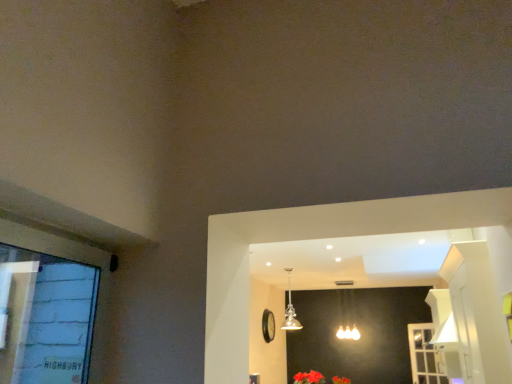
The image size is (512, 384). Describe the element at coordinates (424, 355) in the screenshot. I see `white plastic screen door at lower right` at that location.

Where is `matte silver lamp at center, the first lamp when ordered from right to left`? matte silver lamp at center, the first lamp when ordered from right to left is located at coordinates (346, 323).

What is the approximate width of fluffy fabric flower at lower center, which appears as the first flower when ordered from the bottom?

It is 16.92 inches.

Locate an element on the screen. The image size is (512, 384). gold glass pendant light at center, which is the second lamp from back to front is located at coordinates (290, 309).

Is gold glass pendant light at center, the first lamp positioned from the left, located within fluffy fabric flower at lower center, the 2th flower positioned from the front?

Definitely not — gold glass pendant light at center, the first lamp positioned from the left, is not inside fluffy fabric flower at lower center, the 2th flower positioned from the front.

From the image's perspective, is fluffy fabric flower at lower center, the 2th flower positioned from the front, on top of gold glass pendant light at center, which is the second lamp from back to front?

No, from the image's perspective, fluffy fabric flower at lower center, the 2th flower positioned from the front, is not above gold glass pendant light at center, which is the second lamp from back to front.

Is fluffy fabric flower at lower center, the 2th flower viewed from the top, taller than gold glass pendant light at center, the first lamp positioned from the left?

No.

Is vivid red petals at lower center, the 2th flower from the back, surrounded by fluffy fabric flower at lower center, the 2th flower viewed from the top?

No, vivid red petals at lower center, the 2th flower from the back, is not a part of fluffy fabric flower at lower center, the 2th flower viewed from the top.

Considering the sizes of objects fluffy fabric flower at lower center, the 2th flower positioned from the front, and vivid red petals at lower center, which is the second flower from right to left, in the image provided, who is taller, fluffy fabric flower at lower center, the 2th flower positioned from the front, or vivid red petals at lower center, which is the second flower from right to left,?

With more height is fluffy fabric flower at lower center, the 2th flower positioned from the front.

Could you measure the distance between fluffy fabric flower at lower center, the 2th flower viewed from the top, and vivid red petals at lower center, which appears as the 2th flower when ordered from the bottom?

fluffy fabric flower at lower center, the 2th flower viewed from the top, is 13.78 inches away from vivid red petals at lower center, which appears as the 2th flower when ordered from the bottom.

Which object is positioned more to the left, fluffy fabric flower at lower center, which appears as the first flower when ordered from the bottom, or vivid red petals at lower center, marked as the first flower in a top-to-bottom arrangement?

vivid red petals at lower center, marked as the first flower in a top-to-bottom arrangement, is more to the left.

Looking at this image, considering the sizes of objects matte silver lamp at center, arranged as the 2th lamp when viewed from the front, and vivid red petals at lower center, marked as the first flower in a top-to-bottom arrangement, in the image provided, who is wider, matte silver lamp at center, arranged as the 2th lamp when viewed from the front, or vivid red petals at lower center, marked as the first flower in a top-to-bottom arrangement,?

Wider between the two is vivid red petals at lower center, marked as the first flower in a top-to-bottom arrangement.

Considering the relative sizes of matte silver lamp at center, which is the 1th lamp from back to front, and vivid red petals at lower center, which is the second flower from right to left, in the image provided, is matte silver lamp at center, which is the 1th lamp from back to front, bigger than vivid red petals at lower center, which is the second flower from right to left,?

Correct, matte silver lamp at center, which is the 1th lamp from back to front, is larger in size than vivid red petals at lower center, which is the second flower from right to left.

Is there a large distance between matte silver lamp at center, arranged as the 2th lamp when viewed from the front, and vivid red petals at lower center, the 2th flower from the back?

matte silver lamp at center, arranged as the 2th lamp when viewed from the front, is actually quite close to vivid red petals at lower center, the 2th flower from the back.

Considering the positions of point (339, 326) and point (321, 381), is point (339, 326) closer or farther from the camera than point (321, 381)?

Clearly, point (339, 326) is more distant from the camera than point (321, 381).

Can you confirm if white plastic screen door at lower right is smaller than matte silver lamp at center, which is the 1th lamp from back to front?

Indeed, white plastic screen door at lower right has a smaller size compared to matte silver lamp at center, which is the 1th lamp from back to front.

Which is more to the left, white plastic screen door at lower right or matte silver lamp at center, which is the 1th lamp from back to front?

Positioned to the left is matte silver lamp at center, which is the 1th lamp from back to front.

From a real-world perspective, which is physically above, white plastic screen door at lower right or matte silver lamp at center, arranged as the 2th lamp when viewed from the front?

matte silver lamp at center, arranged as the 2th lamp when viewed from the front.

The width and height of the screenshot is (512, 384). I want to click on the 1st lamp above the white plastic screen door at lower right (from the image's perspective), so click(346, 323).

Considering the sizes of objects matte silver lamp at center, which is the 2th lamp from left to right, and fluffy fabric flower at lower center, which is the second flower from left to right, in the image provided, who is thinner, matte silver lamp at center, which is the 2th lamp from left to right, or fluffy fabric flower at lower center, which is the second flower from left to right,?

matte silver lamp at center, which is the 2th lamp from left to right.

Would you consider matte silver lamp at center, which is the 2th lamp from left to right, to be distant from fluffy fabric flower at lower center, which is the second flower from left to right?

No, there isn't a large distance between matte silver lamp at center, which is the 2th lamp from left to right, and fluffy fabric flower at lower center, which is the second flower from left to right.

Can you tell me how much matte silver lamp at center, which is the 1th lamp from back to front, and fluffy fabric flower at lower center, which appears as the first flower when ordered from the bottom, differ in facing direction?

3.37 degrees separate the facing orientations of matte silver lamp at center, which is the 1th lamp from back to front, and fluffy fabric flower at lower center, which appears as the first flower when ordered from the bottom.

Relative to fluffy fabric flower at lower center, which appears as the first flower when ordered from the bottom, is matte silver lamp at center, which is the 2th lamp from left to right, in front or behind?

matte silver lamp at center, which is the 2th lamp from left to right, is positioned farther from the viewer than fluffy fabric flower at lower center, which appears as the first flower when ordered from the bottom.

From the image's perspective, between white plastic screen door at lower right and vivid red petals at lower center, the 1th flower when ordered from front to back, which one is located above?

vivid red petals at lower center, the 1th flower when ordered from front to back, from the image's perspective.

There is a vivid red petals at lower center, which is the second flower from right to left. At what (x,y) coordinates should I click in order to perform the action: click on screen door above it (from a real-world perspective). Please return your answer as a coordinate pair (x, y). Looking at the image, I should click on (424, 355).

Is white plastic screen door at lower right bigger or smaller than vivid red petals at lower center, marked as the first flower in a top-to-bottom arrangement?

In the image, white plastic screen door at lower right appears to be larger than vivid red petals at lower center, marked as the first flower in a top-to-bottom arrangement.

Measure the distance between white plastic screen door at lower right and vivid red petals at lower center, marked as the first flower in a top-to-bottom arrangement.

They are 2.24 meters apart.

Between gold glass pendant light at center, the 2th lamp from the right, and white plastic screen door at lower right, which one has more height?

Standing taller between the two is white plastic screen door at lower right.

Who is more distant, gold glass pendant light at center, which is counted as the first lamp, starting from the front, or white plastic screen door at lower right?

Positioned behind is white plastic screen door at lower right.

Is gold glass pendant light at center, which is the second lamp from back to front, at the left side of white plastic screen door at lower right?

Correct, you'll find gold glass pendant light at center, which is the second lamp from back to front, to the left of white plastic screen door at lower right.

Where is `lamp lying on the left of fluffy fabric flower at lower center, arranged as the 1th flower when viewed from the back`? lamp lying on the left of fluffy fabric flower at lower center, arranged as the 1th flower when viewed from the back is located at coordinates (290, 309).

At what (x,y) coordinates should I click in order to perform the action: click on flower to the right of vivid red petals at lower center, which is the second flower from right to left. Please return your answer as a coordinate pair (x, y). Looking at the image, I should click on click(x=340, y=380).

Estimate the real-world distances between objects in this image. Which object is closer to fluffy fabric flower at lower center, arranged as the 1th flower when viewed from the back, white plastic screen door at lower right or vivid red petals at lower center, which appears as the 2th flower when ordered from the bottom?

Based on the image, vivid red petals at lower center, which appears as the 2th flower when ordered from the bottom, appears to be nearer to fluffy fabric flower at lower center, arranged as the 1th flower when viewed from the back.

Estimate the real-world distances between objects in this image. Which object is further from matte silver lamp at center, which is the 1th lamp from back to front, fluffy fabric flower at lower center, which is the second flower from left to right, or vivid red petals at lower center, the 1th flower when ordered from front to back?

vivid red petals at lower center, the 1th flower when ordered from front to back, lies further to matte silver lamp at center, which is the 1th lamp from back to front, than the other object.

From the image, which object appears to be farther from fluffy fabric flower at lower center, which is the second flower from left to right, vivid red petals at lower center, which appears as the 2th flower when ordered from the bottom, or white plastic screen door at lower right?

Based on the image, white plastic screen door at lower right appears to be further to fluffy fabric flower at lower center, which is the second flower from left to right.

When comparing their distances from fluffy fabric flower at lower center, the first flower viewed from the right, does white plastic screen door at lower right or gold glass pendant light at center, which is the second lamp from back to front, seem further?

white plastic screen door at lower right is further to fluffy fabric flower at lower center, the first flower viewed from the right.

Which object lies further to the anchor point vivid red petals at lower center, marked as the 1th flower in a left-to-right arrangement, gold glass pendant light at center, the 2th lamp from the right, or matte silver lamp at center, the first lamp when ordered from right to left?

matte silver lamp at center, the first lamp when ordered from right to left, is further to vivid red petals at lower center, marked as the 1th flower in a left-to-right arrangement.

From the picture: Considering their positions, is white plastic screen door at lower right positioned closer to gold glass pendant light at center, which is counted as the first lamp, starting from the front, than fluffy fabric flower at lower center, the 2th flower positioned from the front?

Based on the image, fluffy fabric flower at lower center, the 2th flower positioned from the front, appears to be nearer to gold glass pendant light at center, which is counted as the first lamp, starting from the front.

From the image, which object appears to be nearer to matte silver lamp at center, which is the 2th lamp from left to right, white plastic screen door at lower right or vivid red petals at lower center, marked as the first flower in a top-to-bottom arrangement?

Among the two, vivid red petals at lower center, marked as the first flower in a top-to-bottom arrangement, is located nearer to matte silver lamp at center, which is the 2th lamp from left to right.

Considering their positions, is fluffy fabric flower at lower center, which appears as the first flower when ordered from the bottom, positioned further to white plastic screen door at lower right than vivid red petals at lower center, marked as the 1th flower in a left-to-right arrangement?

Based on the image, vivid red petals at lower center, marked as the 1th flower in a left-to-right arrangement, appears to be further to white plastic screen door at lower right.

At what (x,y) coordinates should I click in order to perform the action: click on lamp between gold glass pendant light at center, the 2th lamp from the right, and fluffy fabric flower at lower center, the 2th flower positioned from the front, in the vertical direction. Please return your answer as a coordinate pair (x, y). Looking at the image, I should click on (346, 323).

Locate an element on the screen. lamp between vivid red petals at lower center, the 1th flower when ordered from front to back, and fluffy fabric flower at lower center, arranged as the 1th flower when viewed from the back, along the z-axis is located at coordinates (290, 309).

Where is `flower between vivid red petals at lower center, the 1th flower when ordered from front to back, and matte silver lamp at center, which is the 2th lamp from left to right, along the z-axis`? flower between vivid red petals at lower center, the 1th flower when ordered from front to back, and matte silver lamp at center, which is the 2th lamp from left to right, along the z-axis is located at coordinates tap(340, 380).

Where is `lamp between fluffy fabric flower at lower center, which is the second flower from left to right, and white plastic screen door at lower right from left to right`? The height and width of the screenshot is (384, 512). lamp between fluffy fabric flower at lower center, which is the second flower from left to right, and white plastic screen door at lower right from left to right is located at coordinates (346, 323).